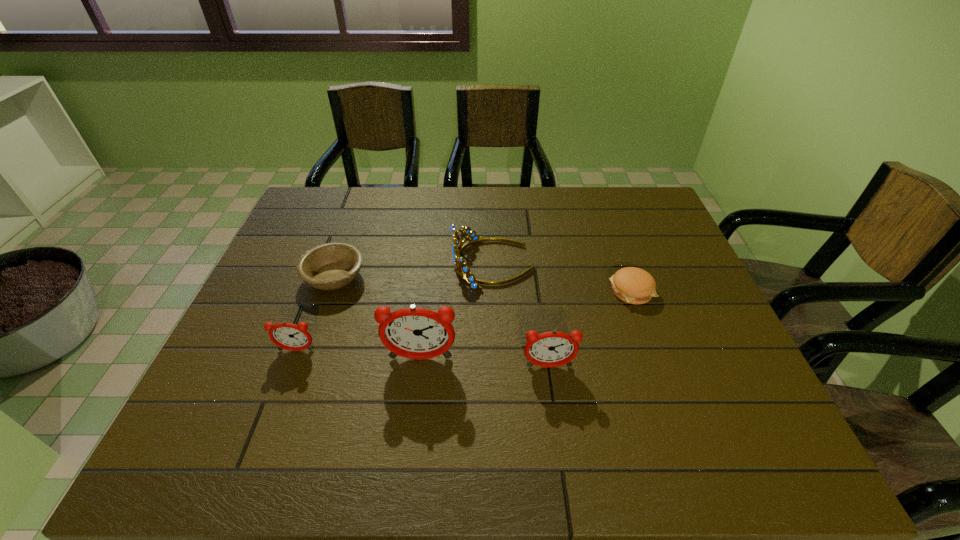
I want to click on free space located on the left of the patty, so click(461, 291).

At what (x,y) coordinates should I click in order to perform the action: click on vacant space located on the front-facing side of the tiara. Please return your answer as a coordinate pair (x, y). The image size is (960, 540). Looking at the image, I should click on (424, 264).

Image resolution: width=960 pixels, height=540 pixels. What are the coordinates of `blank space located 0.330m on the front-facing side of the tiara` in the screenshot? It's located at (337, 264).

Find the location of a particular element. The width and height of the screenshot is (960, 540). free space located 0.070m on the front-facing side of the tiara is located at coordinates (428, 264).

At what (x,y) coordinates should I click in order to perform the action: click on vacant position located on the front of the bowl. Please return your answer as a coordinate pair (x, y). This screenshot has height=540, width=960. Looking at the image, I should click on (295, 389).

Locate an element on the screen. The height and width of the screenshot is (540, 960). alarm clock that is positioned at the left edge is located at coordinates click(x=288, y=336).

The width and height of the screenshot is (960, 540). What are the coordinates of `bowl situated at the left edge` in the screenshot? It's located at (333, 265).

Where is `object located at the right edge`? This screenshot has width=960, height=540. object located at the right edge is located at coordinates (633, 285).

This screenshot has width=960, height=540. In the image, there is a desktop. Find the location of `vacant space at the far edge`. vacant space at the far edge is located at coordinates (515, 223).

The width and height of the screenshot is (960, 540). What are the coordinates of `free space at the near edge` in the screenshot? It's located at (416, 412).